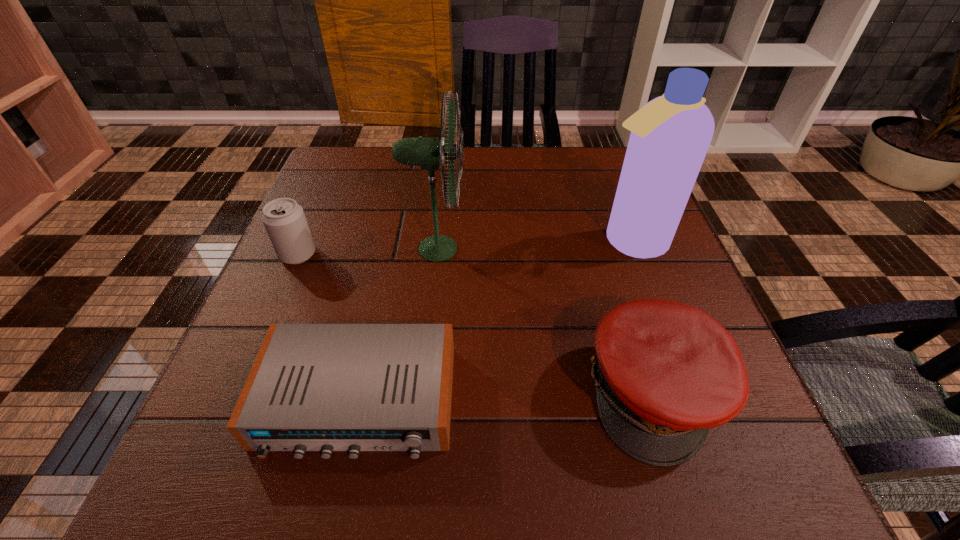
Identify the location of vacant position at the far left corner of the desktop. tap(369, 172).

The width and height of the screenshot is (960, 540). Find the location of `vacant region at the near right corner of the desktop`. vacant region at the near right corner of the desktop is located at coordinates (776, 477).

The height and width of the screenshot is (540, 960). I want to click on blank region between the fan and the shampoo, so click(533, 245).

The width and height of the screenshot is (960, 540). What are the coordinates of `unoccupied area between the radio receiver and the cap` in the screenshot? It's located at (506, 396).

You are a GUI agent. You are given a task and a screenshot of the screen. Output one action in this format:
    pyautogui.click(x=<x>, y=<y>)
    Task: Click on the free space between the shortest object and the cap
    The width and height of the screenshot is (960, 540).
    Given the screenshot: What is the action you would take?
    pyautogui.click(x=506, y=396)

Image resolution: width=960 pixels, height=540 pixels. Find the location of `free space that is in between the cap and the leftmost object`. free space that is in between the cap and the leftmost object is located at coordinates (476, 323).

Image resolution: width=960 pixels, height=540 pixels. I want to click on free space between the cap and the fan, so click(545, 321).

At what (x,y) coordinates should I click in order to perform the action: click on vacant space in between the fan and the cap. Please return your answer as a coordinate pair (x, y). The height and width of the screenshot is (540, 960). Looking at the image, I should click on (545, 321).

You are a GUI agent. You are given a task and a screenshot of the screen. Output one action in this format:
    pyautogui.click(x=<x>, y=<y>)
    Task: Click on the unoccupied area between the shampoo and the leftmost object
    
    Given the screenshot: What is the action you would take?
    pyautogui.click(x=464, y=248)

Where is `the closest object to the radio receiver`? the closest object to the radio receiver is located at coordinates (428, 153).